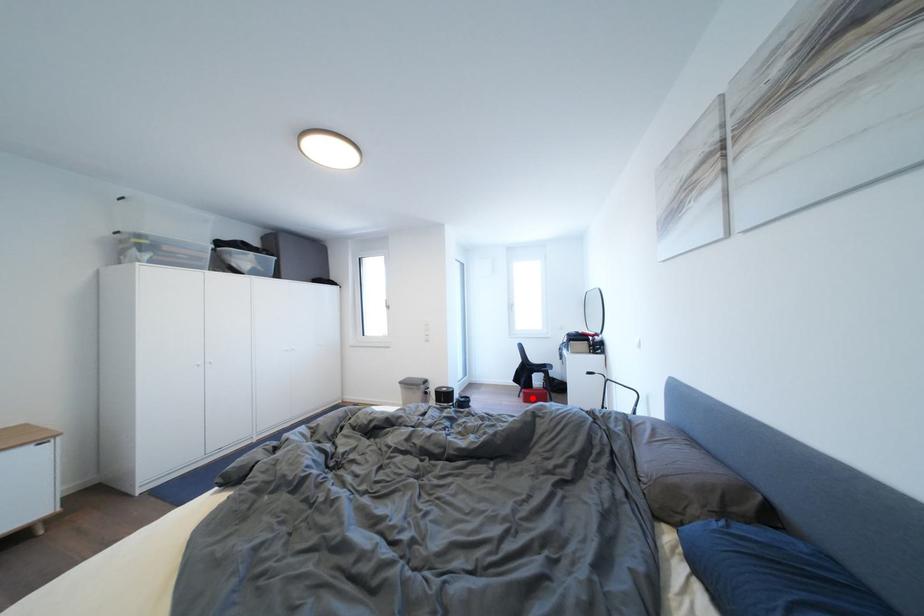
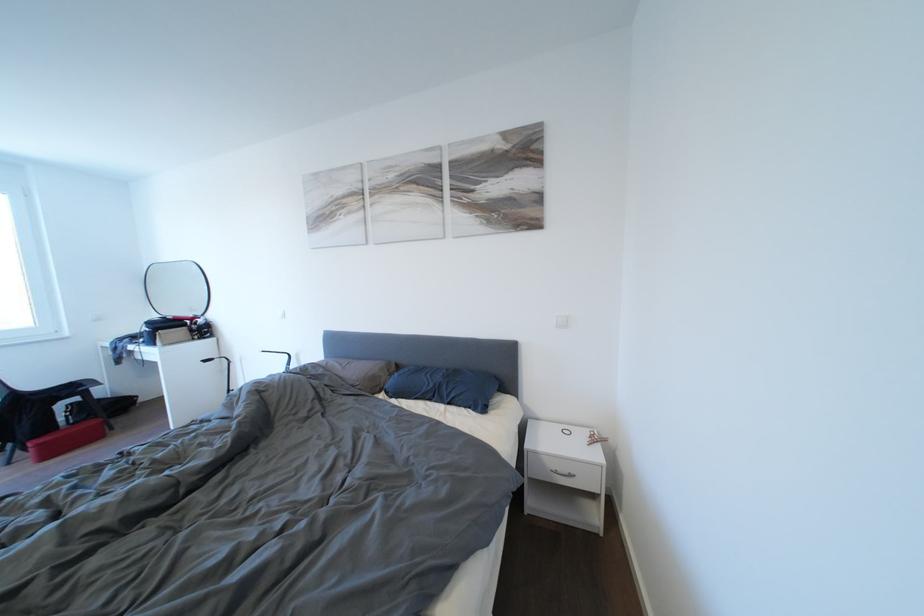
In the second image, find the point that corresponds to the highlighted location in the first image.

(46, 450)